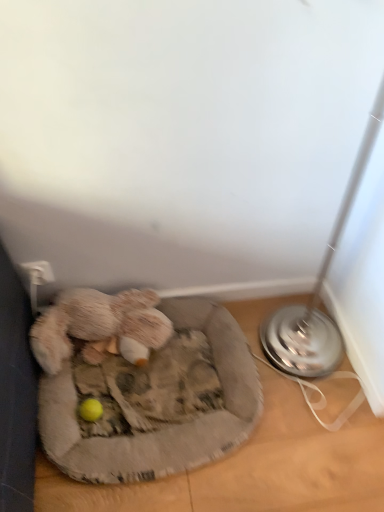
Question: Should I look upward or downward to see fluffy gray dog bed at lower left?

Choices:
 (A) down
 (B) up

Answer: (A)

Question: Should I look upward or downward to see fuzzy beige stuffed animal at lower left?

Choices:
 (A) down
 (B) up

Answer: (A)

Question: Could you tell me if fluffy gray dog bed at lower left is turned towards fuzzy beige stuffed animal at lower left?

Choices:
 (A) no
 (B) yes

Answer: (A)

Question: Can you see fluffy gray dog bed at lower left touching fuzzy beige stuffed animal at lower left?

Choices:
 (A) yes
 (B) no

Answer: (B)

Question: Can you confirm if fluffy gray dog bed at lower left is smaller than fuzzy beige stuffed animal at lower left?

Choices:
 (A) yes
 (B) no

Answer: (B)

Question: From the image's perspective, would you say fluffy gray dog bed at lower left is positioned over fuzzy beige stuffed animal at lower left?

Choices:
 (A) yes
 (B) no

Answer: (B)

Question: Is fluffy gray dog bed at lower left positioned beyond the bounds of fuzzy beige stuffed animal at lower left?

Choices:
 (A) no
 (B) yes

Answer: (B)

Question: From a real-world perspective, is fluffy gray dog bed at lower left beneath fuzzy beige stuffed animal at lower left?

Choices:
 (A) yes
 (B) no

Answer: (A)

Question: From a real-world perspective, is fuzzy beige stuffed animal at lower left positioned under fluffy gray dog bed at lower left based on gravity?

Choices:
 (A) no
 (B) yes

Answer: (A)

Question: Would you say fuzzy beige stuffed animal at lower left contains fluffy gray dog bed at lower left?

Choices:
 (A) no
 (B) yes

Answer: (A)

Question: Is the position of fuzzy beige stuffed animal at lower left more distant than that of fluffy gray dog bed at lower left?

Choices:
 (A) yes
 (B) no

Answer: (A)

Question: Does fuzzy beige stuffed animal at lower left have a greater width compared to fluffy gray dog bed at lower left?

Choices:
 (A) no
 (B) yes

Answer: (A)

Question: From the image's perspective, is fuzzy beige stuffed animal at lower left located above fluffy gray dog bed at lower left?

Choices:
 (A) yes
 (B) no

Answer: (A)

Question: From a real-world perspective, is fuzzy beige stuffed animal at lower left positioned over fluffy gray dog bed at lower left based on gravity?

Choices:
 (A) no
 (B) yes

Answer: (B)

Question: Choose the correct answer: Is fuzzy beige stuffed animal at lower left inside fluffy gray dog bed at lower left or outside it?

Choices:
 (A) inside
 (B) outside

Answer: (B)